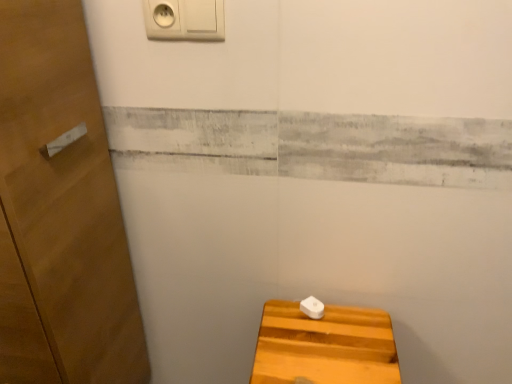
Question: Is white plastic/light switch at upper center in front of or behind white plastic knob at lower center in the image?

Choices:
 (A) behind
 (B) front

Answer: (B)

Question: From the image's perspective, is white plastic/light switch at upper center positioned above or below white plastic knob at lower center?

Choices:
 (A) below
 (B) above

Answer: (B)

Question: Which object is positioned closest to the wooden door at left?

Choices:
 (A) light brown wooden stool at lower right
 (B) white plastic/light switch at upper center
 (C) white plastic knob at lower center

Answer: (B)

Question: Which object is positioned farthest from the light brown wooden stool at lower right?

Choices:
 (A) white plastic knob at lower center
 (B) wooden door at left
 (C) white plastic/light switch at upper center

Answer: (C)